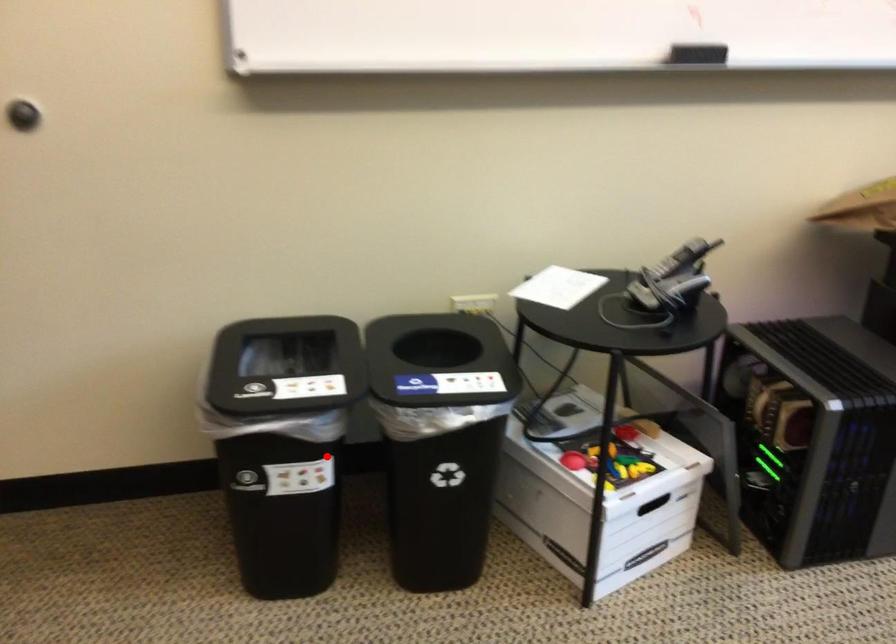
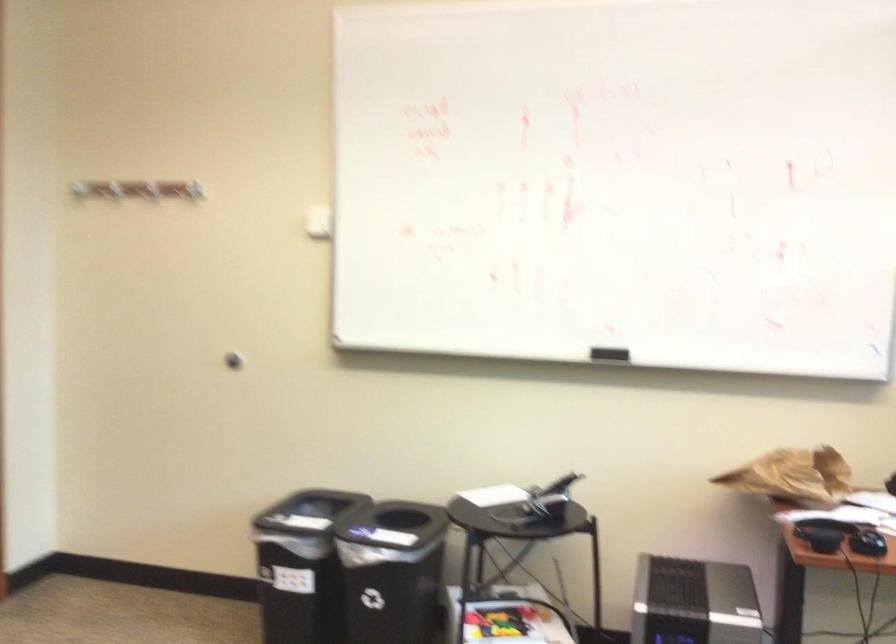
Find the pixel in the second image that matches the highlighted location in the first image.

(300, 565)